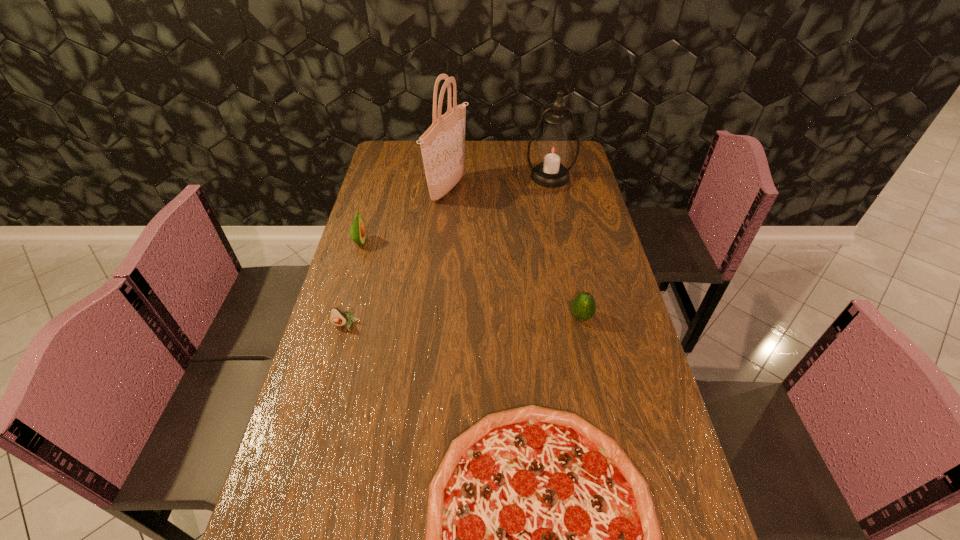
At what (x,y) coordinates should I click in order to perform the action: click on shopping bag. Please return your answer as a coordinate pair (x, y). Looking at the image, I should click on (443, 144).

In order to click on oil lamp in this screenshot , I will do `click(553, 149)`.

Identify the location of the fourth shortest object. click(357, 230).

Identify the location of the farthest avocado. (357, 230).

Find the location of a particular element. The width and height of the screenshot is (960, 540). the fourth tallest object is located at coordinates (583, 307).

The width and height of the screenshot is (960, 540). I want to click on the rightmost avocado, so click(583, 307).

Where is `the shortest avocado`? The height and width of the screenshot is (540, 960). the shortest avocado is located at coordinates (337, 317).

At what (x,y) coordinates should I click in order to perform the action: click on free space located 0.050m on the left of the shopping bag. Please return your answer as a coordinate pair (x, y). The width and height of the screenshot is (960, 540). Looking at the image, I should click on (414, 189).

The image size is (960, 540). I want to click on vacant area situated 0.110m on the left of the oil lamp, so click(497, 177).

Locate an element on the screen. free spot located on the cut side of the fourth shortest object is located at coordinates (458, 242).